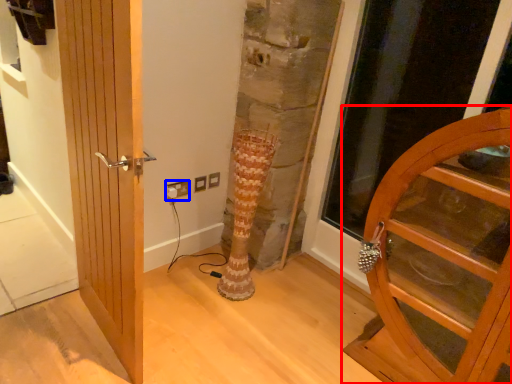
Question: Which of the following is the closest to the observer, door (highlighted by a red box) or electric outlet (highlighted by a blue box)?

Choices:
 (A) door
 (B) electric outlet

Answer: (A)